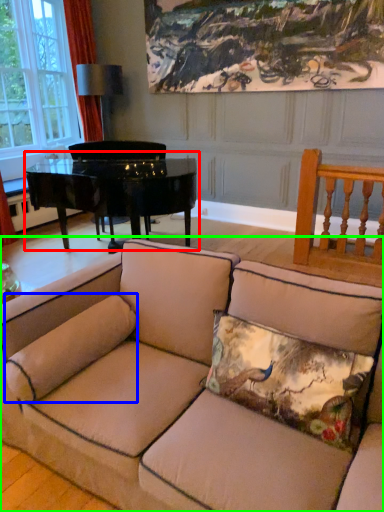
Question: Which is farther away from table (highlighted by a red box)? pillow (highlighted by a blue box) or studio couch (highlighted by a green box)?

Choices:
 (A) pillow
 (B) studio couch

Answer: (A)